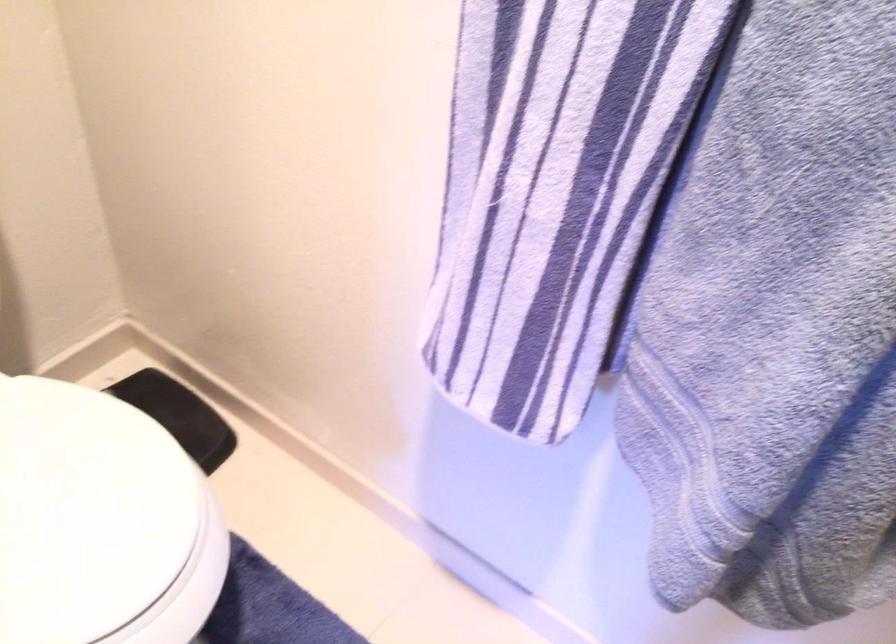
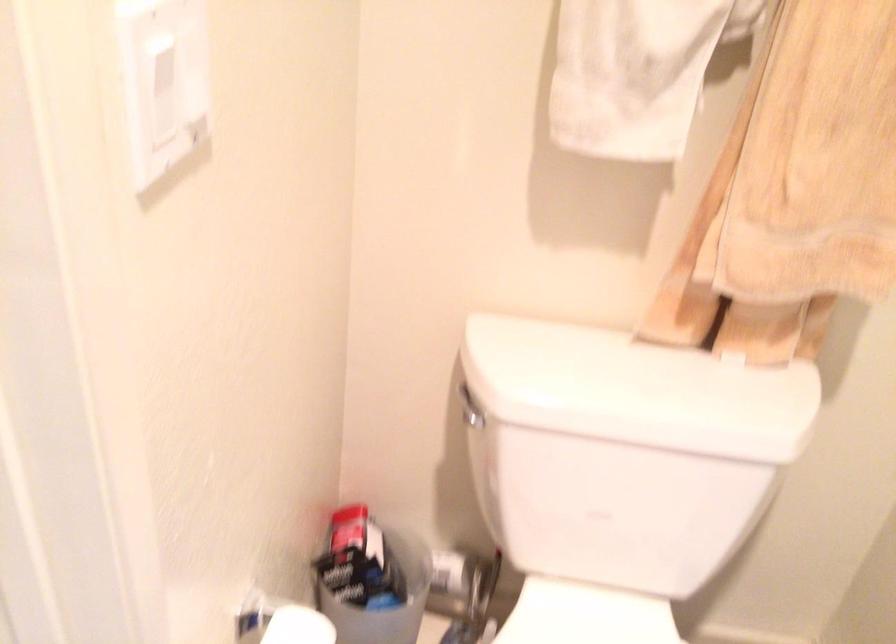
Question: The camera is either moving clockwise (left) or counter-clockwise (right) around the object. The first image is from the beginning of the video and the second image is from the end. Is the camera moving left or right when shooting the video?

Choices:
 (A) Left
 (B) Right

Answer: (B)